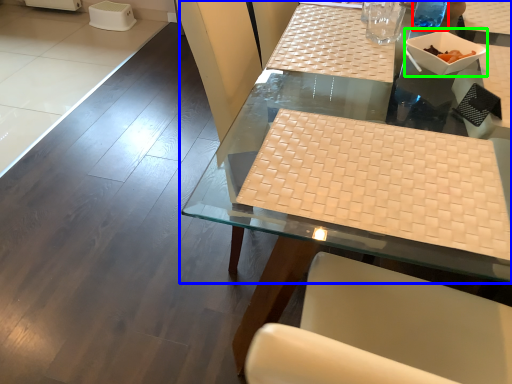
Question: Which is nearer to the beverage (highlighted by a red box)? table (highlighted by a blue box) or bowl (highlighted by a green box).

Choices:
 (A) table
 (B) bowl

Answer: (B)